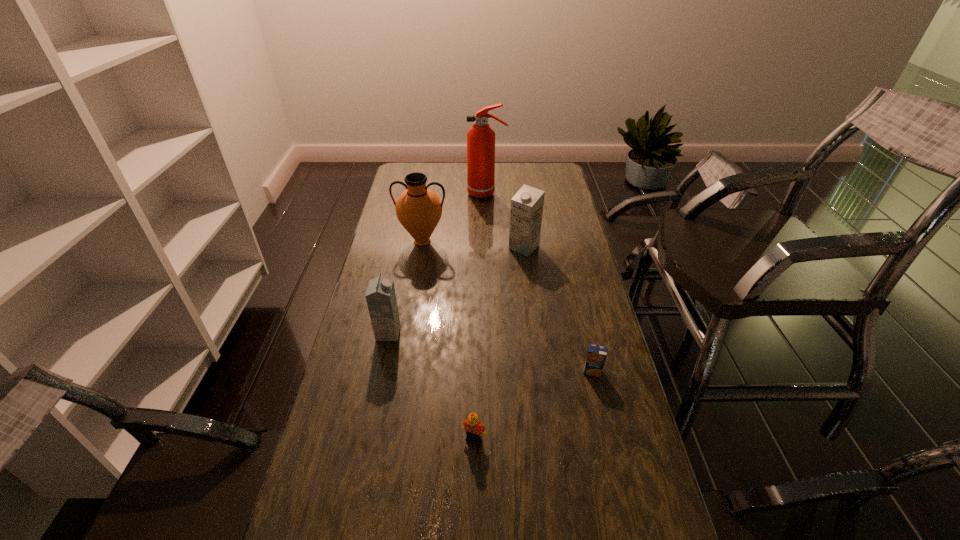
This screenshot has height=540, width=960. What are the coordinates of `vacant space at the far edge` in the screenshot? It's located at (455, 185).

Find the location of `free space at the left edge`. free space at the left edge is located at coordinates (396, 265).

This screenshot has width=960, height=540. What are the coordinates of `vacant space at the right edge of the desktop` in the screenshot? It's located at (589, 499).

I want to click on vacant space in between the farthest object and the pitcher, so click(x=454, y=218).

Where is `blank region between the left carton and the pitcher`? This screenshot has width=960, height=540. blank region between the left carton and the pitcher is located at coordinates (405, 287).

This screenshot has width=960, height=540. Find the location of `free space that is in between the farther carton and the pitcher`. free space that is in between the farther carton and the pitcher is located at coordinates (473, 244).

Find the location of a particular element. This screenshot has height=540, width=960. vacant point located between the left carton and the second nearest object is located at coordinates (491, 352).

Find the location of a particular element. free spot between the fifth farthest object and the nearest object is located at coordinates (533, 405).

The height and width of the screenshot is (540, 960). In order to click on vacant space that is in between the nearer carton and the pitcher in this screenshot , I will do `click(405, 287)`.

Where is `vacant space that's between the left carton and the nearest object`? vacant space that's between the left carton and the nearest object is located at coordinates (431, 386).